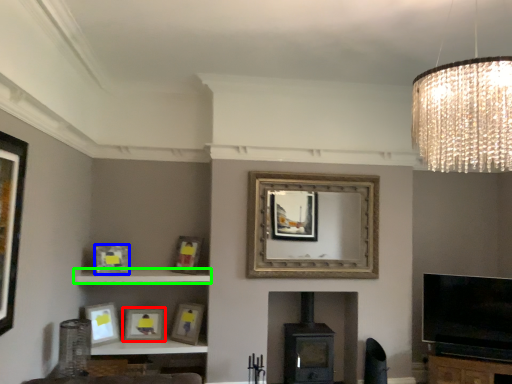
Question: Considering the real-world distances, which object is farthest from picture frame (highlighted by a red box)? picture frame (highlighted by a blue box) or shelf (highlighted by a green box)?

Choices:
 (A) picture frame
 (B) shelf

Answer: (A)